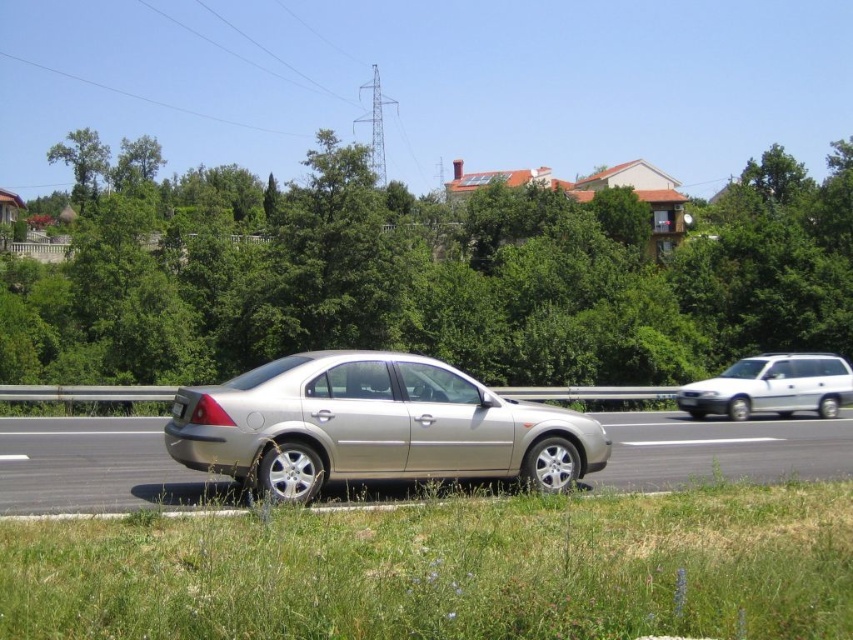
Is green grass at lower center thinner than white matte suv at right?

Yes, green grass at lower center is thinner than white matte suv at right.

This screenshot has height=640, width=853. Identify the location of green grass at lower center. (448, 570).

Does green leafy tree at center have a larger size compared to silver metallic car at center?

Indeed, green leafy tree at center has a larger size compared to silver metallic car at center.

Which is in front, point (102, 358) or point (24, 490)?

Point (24, 490) is more forward.

Measure the distance between point (795, 211) and camera.

48.61 meters

Find the location of a particular element. Image resolution: width=853 pixels, height=640 pixels. green leafy tree at center is located at coordinates (436, 280).

Can you confirm if satin silver car at center is positioned to the left of silver metallic car at center?

Indeed, satin silver car at center is positioned on the left side of silver metallic car at center.

In the scene shown: Can you confirm if satin silver car at center is positioned below silver metallic car at center?

No, satin silver car at center is not below silver metallic car at center.

Identify the location of satin silver car at center. This screenshot has width=853, height=640. (374, 426).